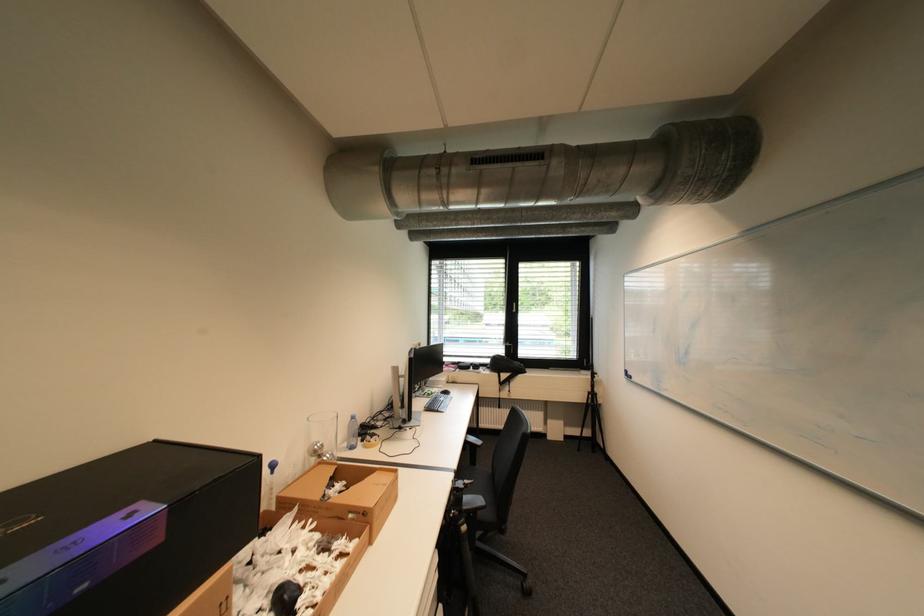
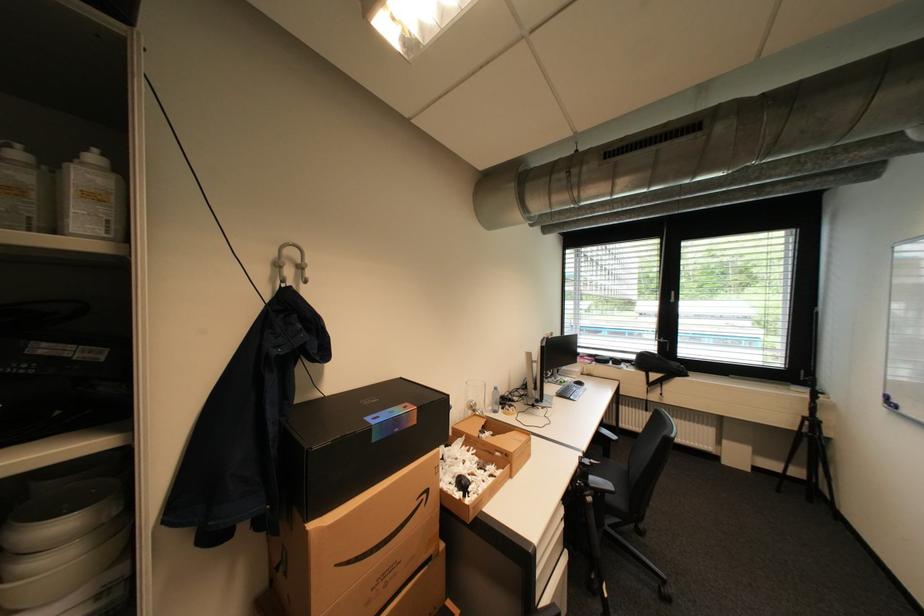
Where in the second image is the point corresponding to [339,477] from the first image?

(492, 426)